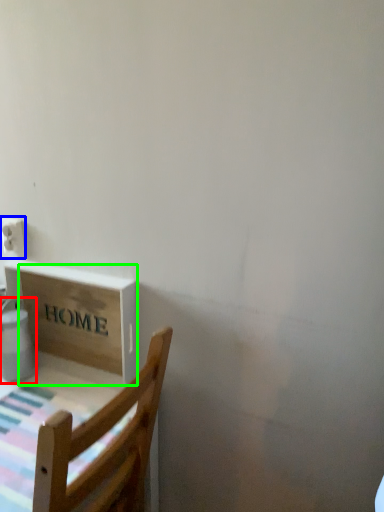
Question: Which is farther away from water heater (highlighted by a red box)? electric outlet (highlighted by a blue box) or cardboard box (highlighted by a green box)?

Choices:
 (A) electric outlet
 (B) cardboard box

Answer: (A)